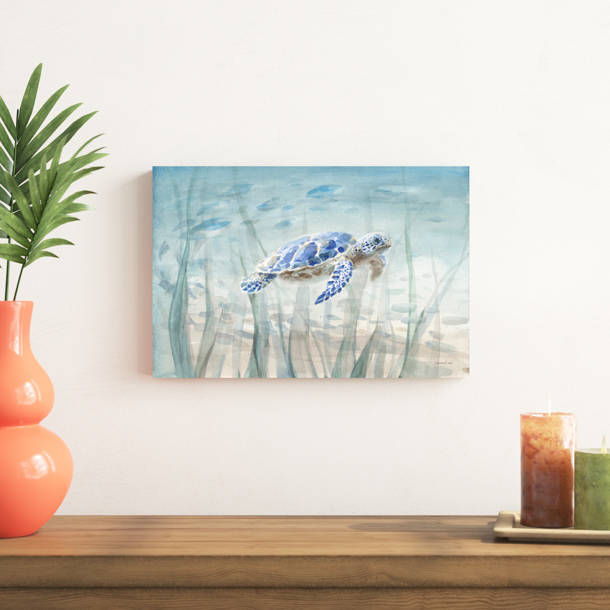
Find the location of a particular element. The width and height of the screenshot is (610, 610). vase is located at coordinates (27, 445).